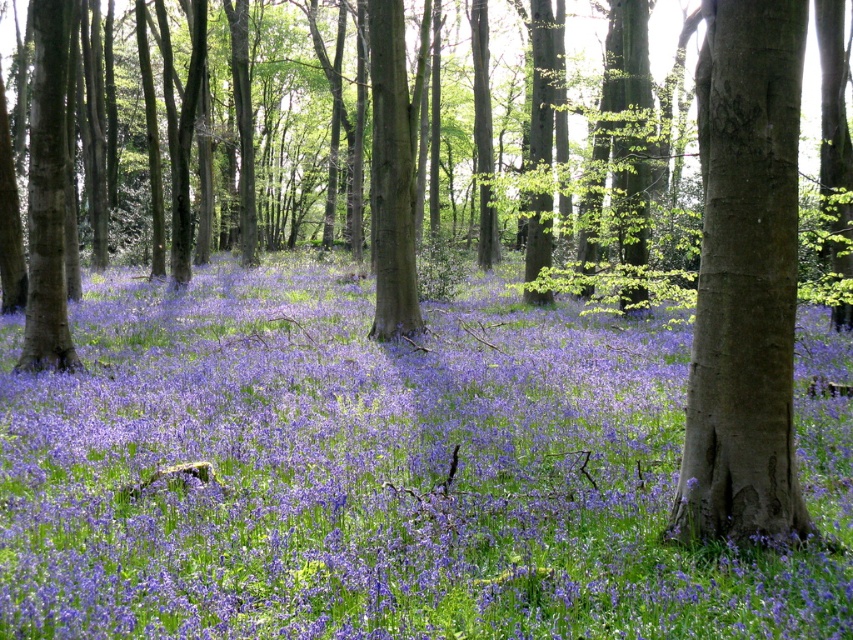
You are standing in the forest and want to walk from point A to point B. Point A is at coordinates point (15, 428) and point B is at coordinates point (670, 525). Which point is closer to you when you start walking?

Point point (15, 428) is closer to you than point point (670, 525) because it is further to the viewer, so you will reach it first.

You are a botanist studying the forest floor and the trees. You notice the purple matte flower at center and the brown rough bark tree at right. Which object has a larger width when viewed from above?

The purple matte flower at center might be wider than brown rough bark tree at right.

You are a hiker who wants to place a 15 feet long tent between the purple matte flower at center and the brown rough bark tree at right. Can you fit the tent between them without moving any of them?

The distance between the purple matte flower at center and the brown rough bark tree at right is 16.90 feet. Since the tent is 15 feet long, it can fit between them as the space available is larger than the tent length.